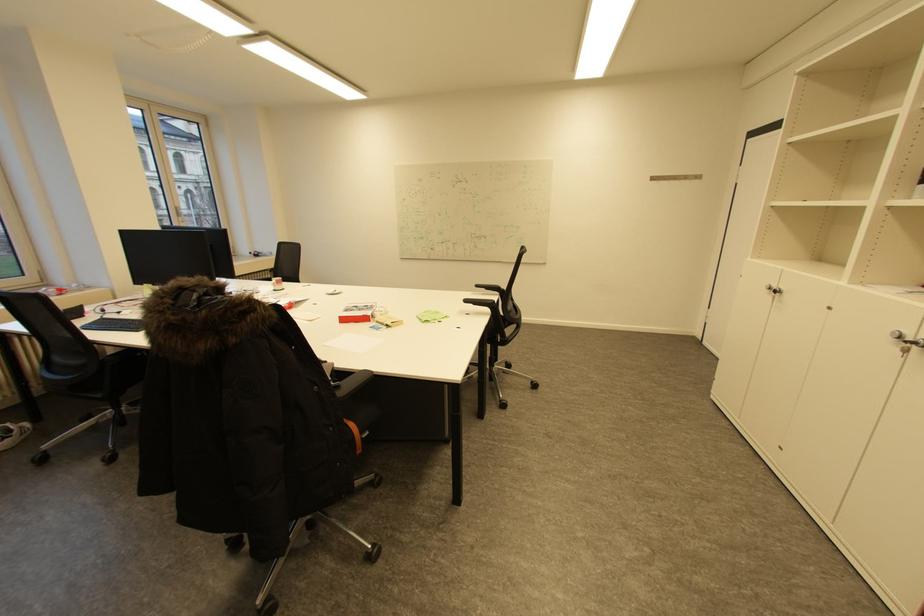
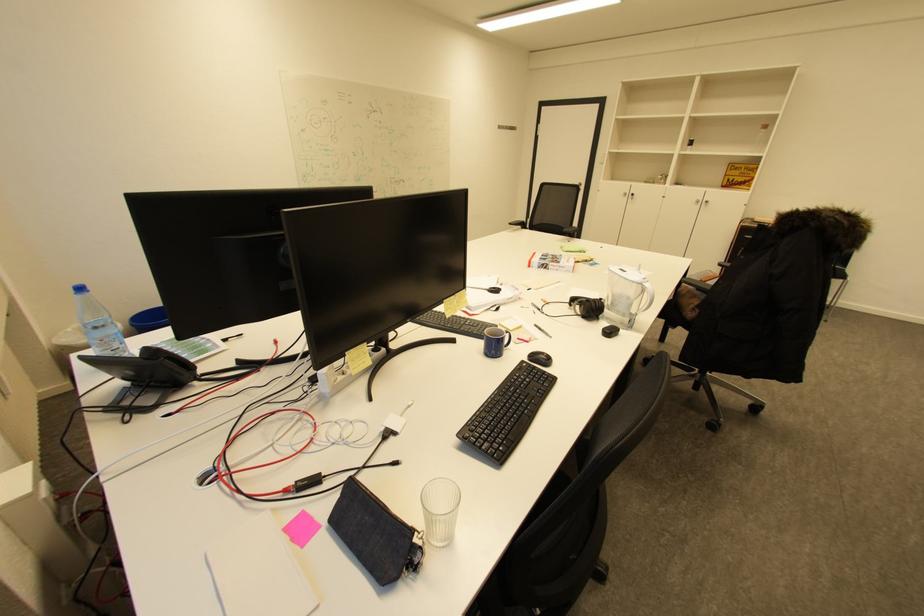
In the second image, find the point that corresponds to [484,286] in the first image.

(517, 225)